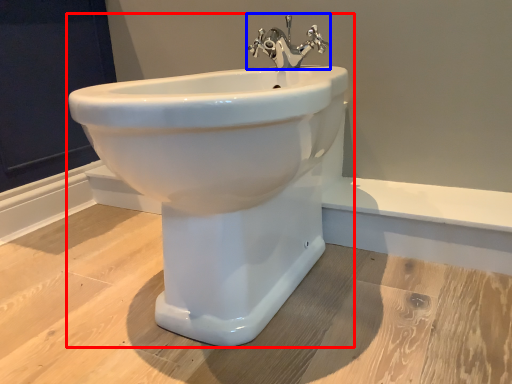
Question: Which of the following is the farthest to the observer, sink (highlighted by a red box) or tap (highlighted by a blue box)?

Choices:
 (A) sink
 (B) tap

Answer: (B)